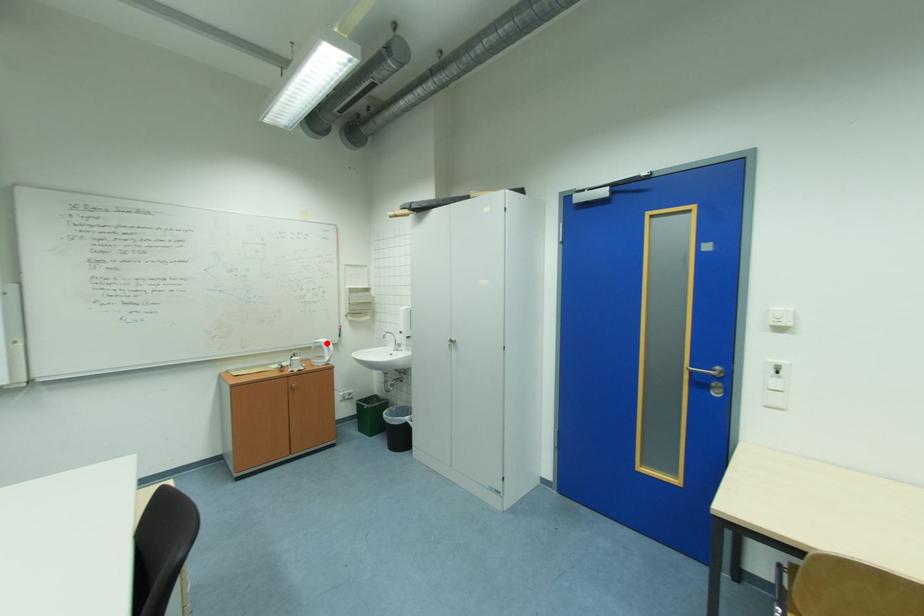
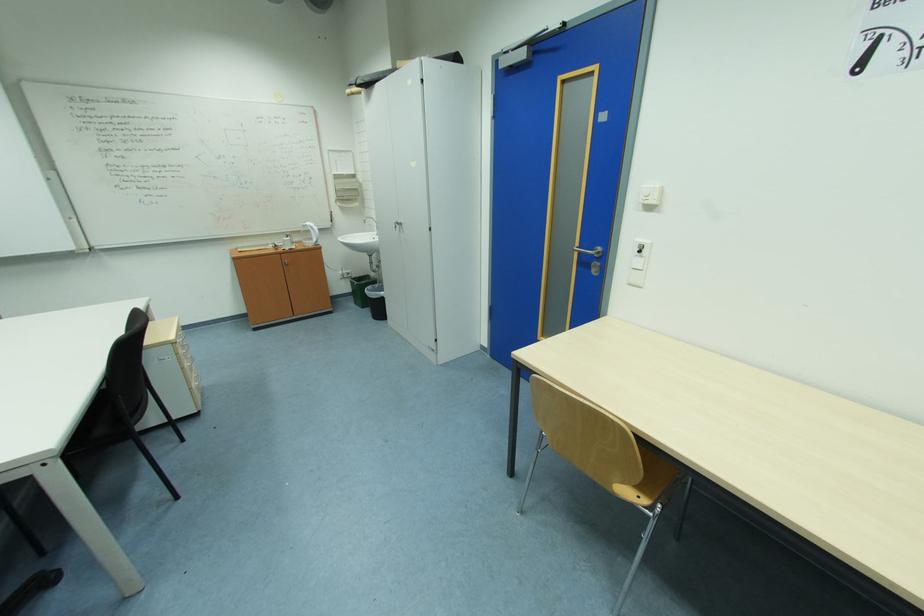
Where in the second image is the point corresponding to the highlighted location from the first image?

(313, 225)